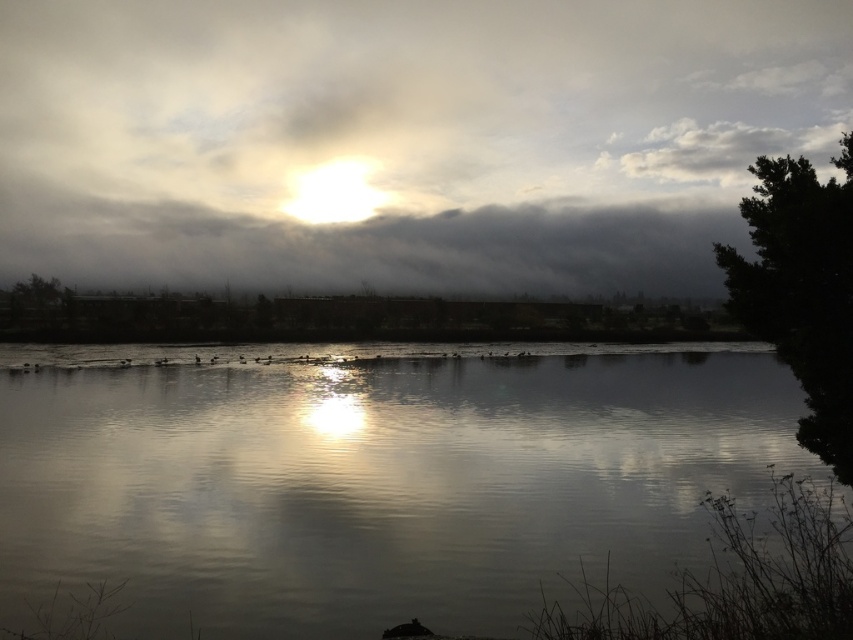
Question: Is silvery reflective water at center behind dark green leafy tree at right?

Choices:
 (A) yes
 (B) no

Answer: (A)

Question: Which of the following is the closest to the observer?

Choices:
 (A) (514, 154)
 (B) (627, 388)
 (C) (802, 218)

Answer: (C)

Question: Is silvery reflective water at center bigger than green leafy tree at left?

Choices:
 (A) no
 (B) yes

Answer: (B)

Question: Which object is the farthest from the silvery reflective water at center?

Choices:
 (A) cloudy sky at upper center
 (B) green leafy tree at left

Answer: (B)

Question: Which point is farther to the camera?

Choices:
 (A) (134, 388)
 (B) (354, 218)
 (C) (44, 307)

Answer: (B)

Question: Can you confirm if silvery reflective water at center is smaller than dark green leafy tree at right?

Choices:
 (A) no
 (B) yes

Answer: (B)